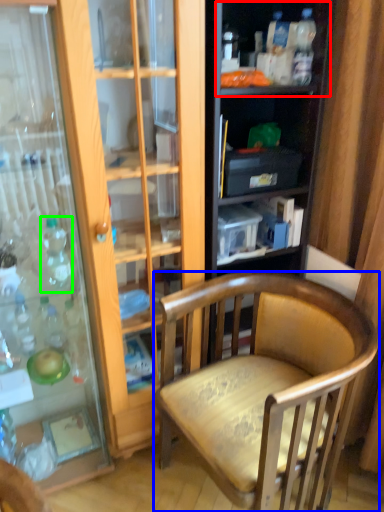
Question: Which is farther away from shelf (highlighted by a red box)? chair (highlighted by a blue box) or bottle (highlighted by a green box)?

Choices:
 (A) chair
 (B) bottle

Answer: (B)